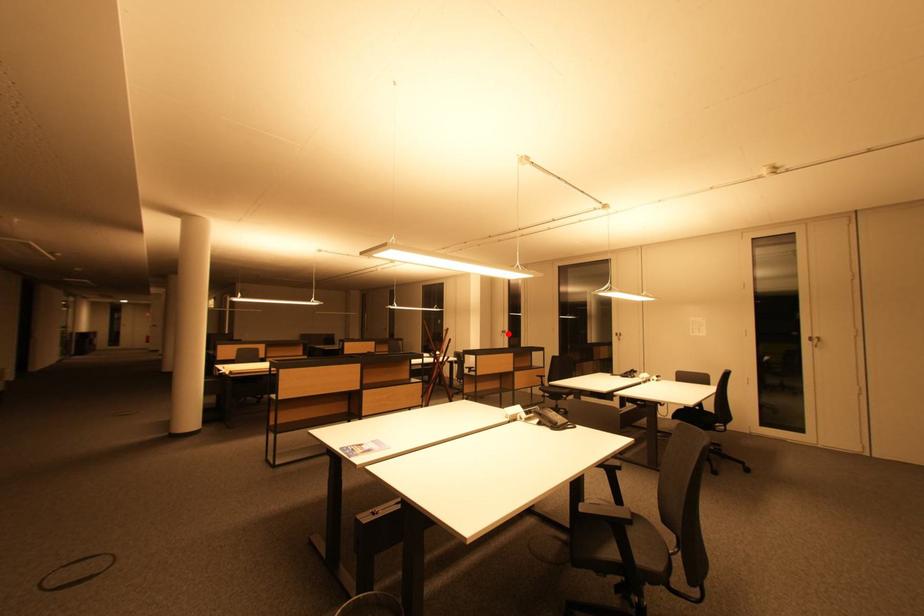
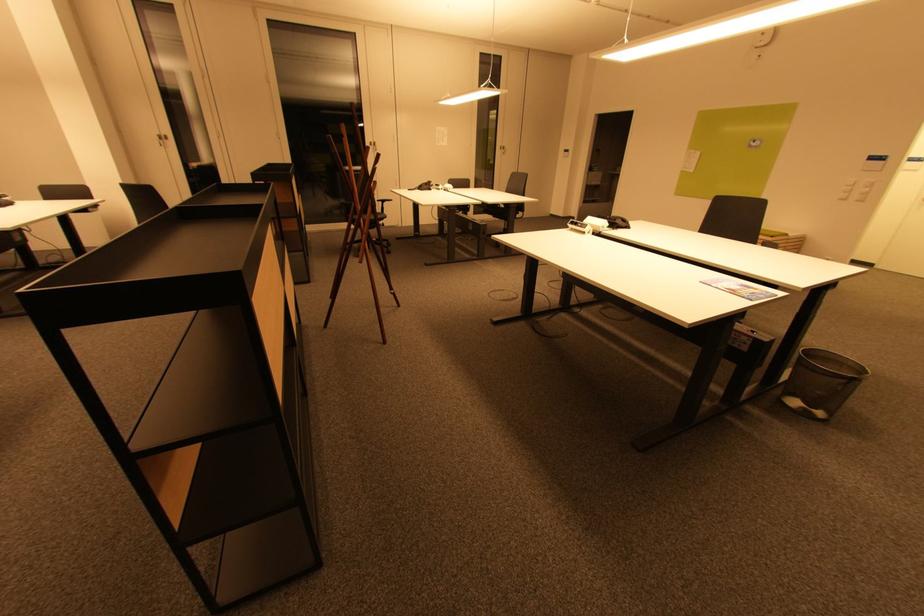
The point at the highlighted location is marked in the first image. Where is the corresponding point in the second image?

(166, 140)